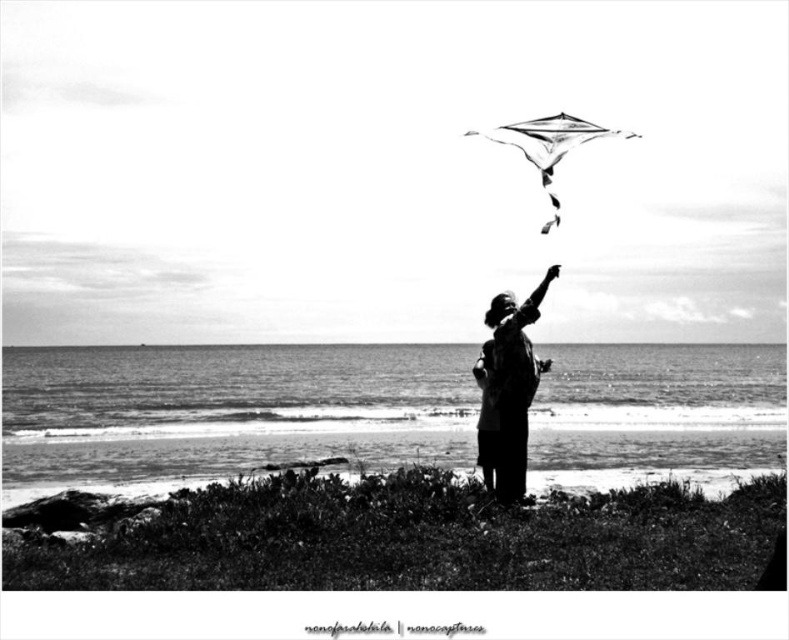
Question: Is dark fabric shirt at center below transparent plastic kite at upper center?

Choices:
 (A) no
 (B) yes

Answer: (B)

Question: Which of the following is the farthest from the observer?

Choices:
 (A) transparent plastic kite at upper center
 (B) dark fabric shirt at center

Answer: (A)

Question: Is dark fabric shirt at center to the right of transparent plastic kite at upper center from the viewer's perspective?

Choices:
 (A) no
 (B) yes

Answer: (A)

Question: Is the position of dark fabric shirt at center less distant than that of transparent plastic kite at upper center?

Choices:
 (A) yes
 (B) no

Answer: (A)

Question: Which point is closer to the camera taking this photo?

Choices:
 (A) (586, 134)
 (B) (496, 429)

Answer: (A)